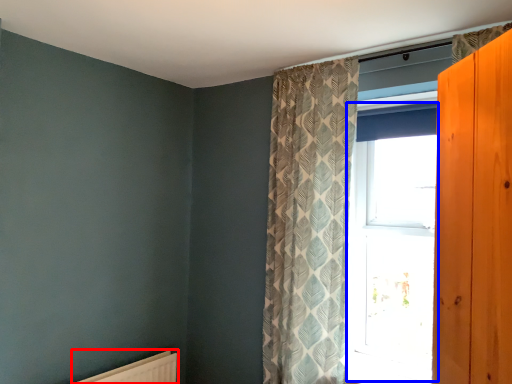
Question: Which object appears farthest to the camera in this image, radiator (highlighted by a red box) or window (highlighted by a blue box)?

Choices:
 (A) radiator
 (B) window

Answer: (B)